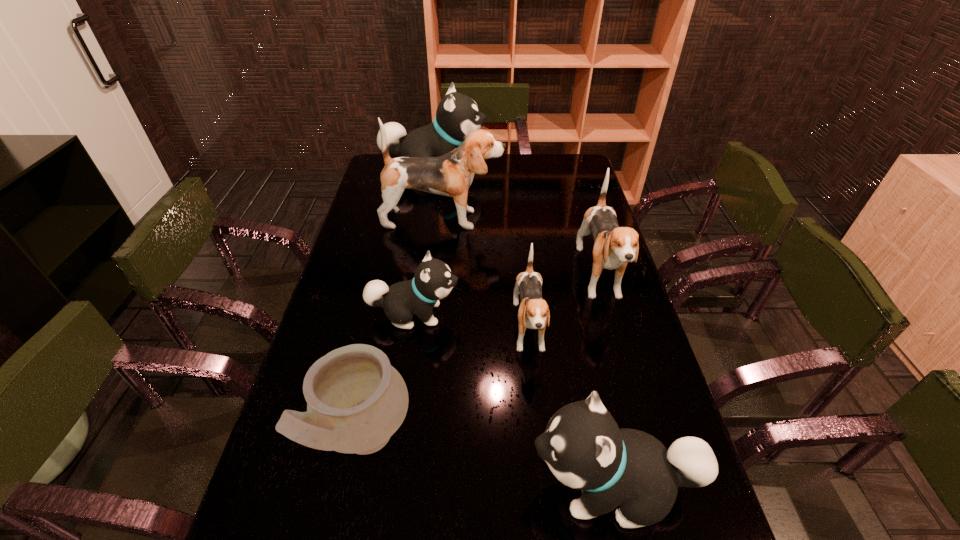
Find the location of `vacant region located 0.070m at the face of the leftmost brown puppy`. vacant region located 0.070m at the face of the leftmost brown puppy is located at coordinates (521, 219).

Where is `vacant space located at the face of the farthest puppy`? This screenshot has width=960, height=540. vacant space located at the face of the farthest puppy is located at coordinates (537, 170).

The image size is (960, 540). Find the location of `vacant space located 0.260m at the face of the second smallest brown puppy`. vacant space located 0.260m at the face of the second smallest brown puppy is located at coordinates (635, 400).

Identify the location of vacant region located 0.270m at the face of the rightmost white puppy. pyautogui.click(x=400, y=487).

Find the location of `free spot located at the face of the rightmost white puppy`. free spot located at the face of the rightmost white puppy is located at coordinates (339, 487).

This screenshot has height=540, width=960. What are the coordinates of `free space located at the face of the rightmost white puppy` in the screenshot? It's located at (494, 487).

The height and width of the screenshot is (540, 960). In order to click on vacant space located 0.060m on the left of the brown pottery in this screenshot , I will do `click(291, 439)`.

Where is `free space located 0.250m at the face of the second brown puppy from left to right`? The image size is (960, 540). free space located 0.250m at the face of the second brown puppy from left to right is located at coordinates (543, 467).

This screenshot has height=540, width=960. Find the location of `vacant region located 0.270m at the face of the smallest white puppy`. vacant region located 0.270m at the face of the smallest white puppy is located at coordinates (552, 314).

In order to click on object that is at the far edge in this screenshot , I will do `click(457, 115)`.